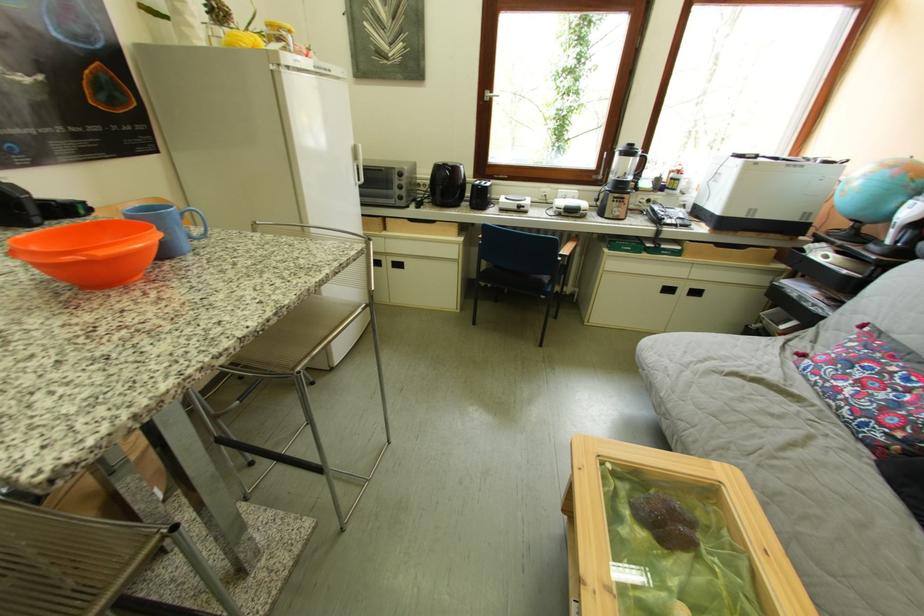
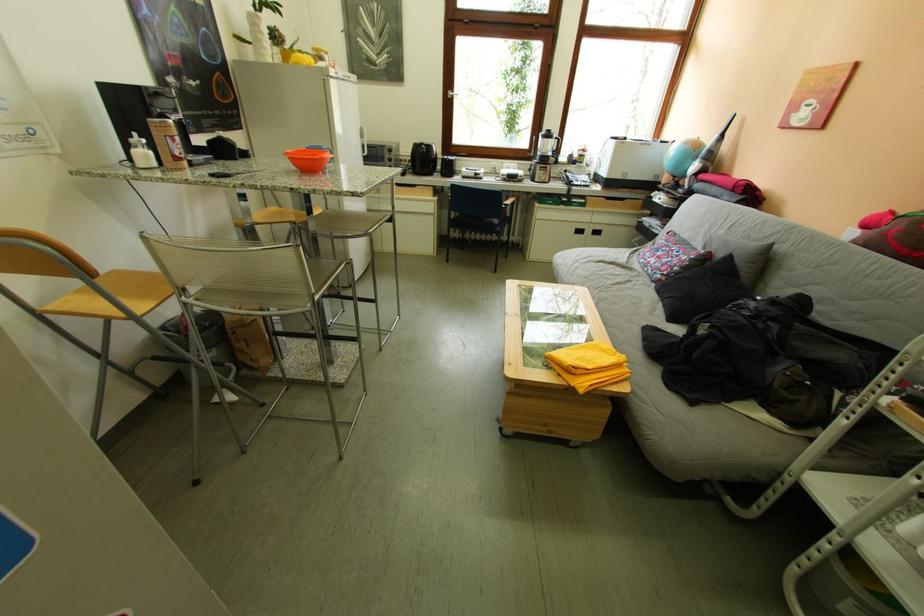
The point at (628, 198) is marked in the first image. Where is the corresponding point in the second image?

(554, 169)